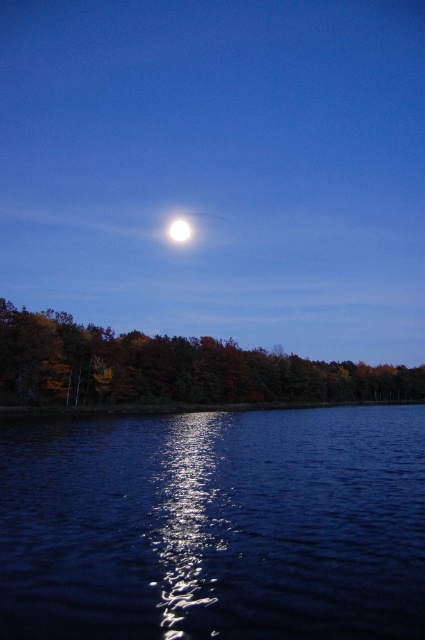
Question: Does glistening dark water at center appear on the right side of bright white orb at upper center?

Choices:
 (A) no
 (B) yes

Answer: (B)

Question: Estimate the real-world distances between objects in this image. Which object is farther from the autumn leaves at lower left?

Choices:
 (A) glistening dark water at center
 (B) bright white moon at upper center

Answer: (B)

Question: Can you confirm if bright white moon at upper center is positioned to the left of glistening dark water at center?

Choices:
 (A) yes
 (B) no

Answer: (A)

Question: Which object is the farthest from the bright white moon at upper center?

Choices:
 (A) bright white orb at upper center
 (B) glistening dark water at center
 (C) autumn leaves at lower left

Answer: (B)

Question: Is bright white moon at upper center bigger than autumn leaves at lower left?

Choices:
 (A) yes
 (B) no

Answer: (A)

Question: Which point appears closest to the camera in this image?

Choices:
 (A) (127, 616)
 (B) (178, 221)

Answer: (A)